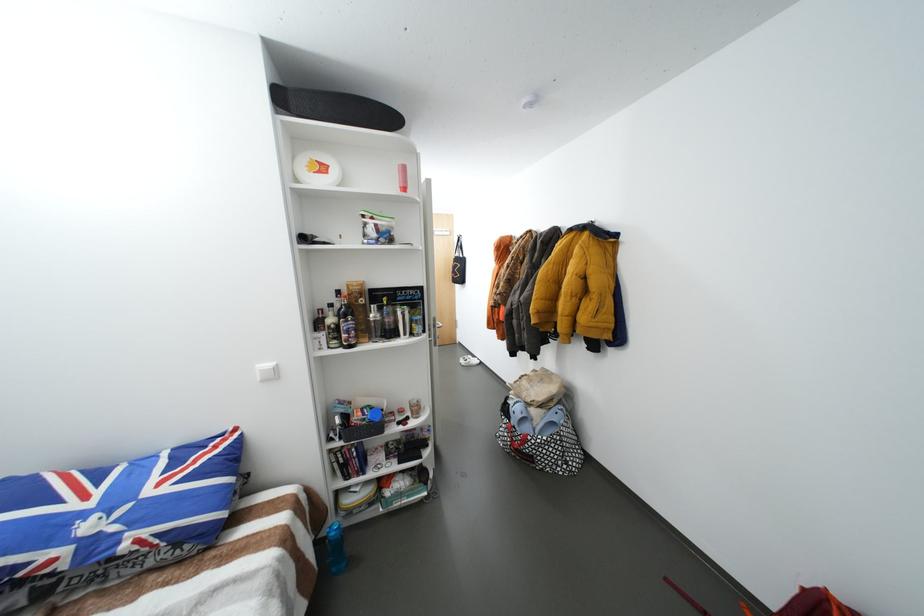
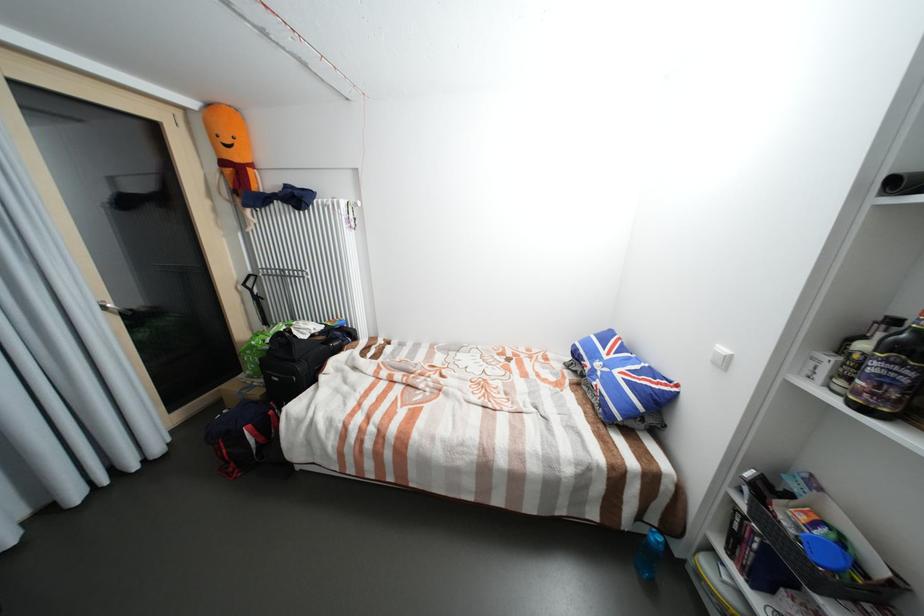
In the second image, find the point that corresponds to the point at 337,306 in the first image.

(901, 322)